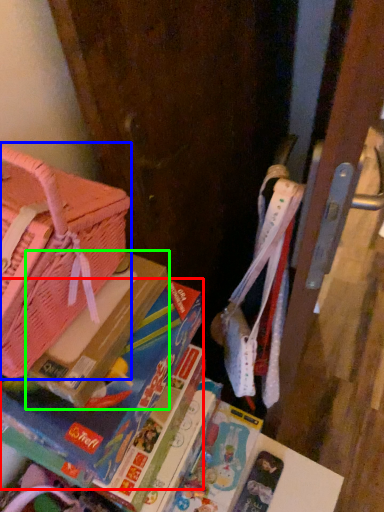
Question: Estimate the real-world distances between objects in this image. Which object is farther from book (highlighted by a red box), handbag (highlighted by a blue box) or paperback book (highlighted by a green box)?

Choices:
 (A) handbag
 (B) paperback book

Answer: (A)